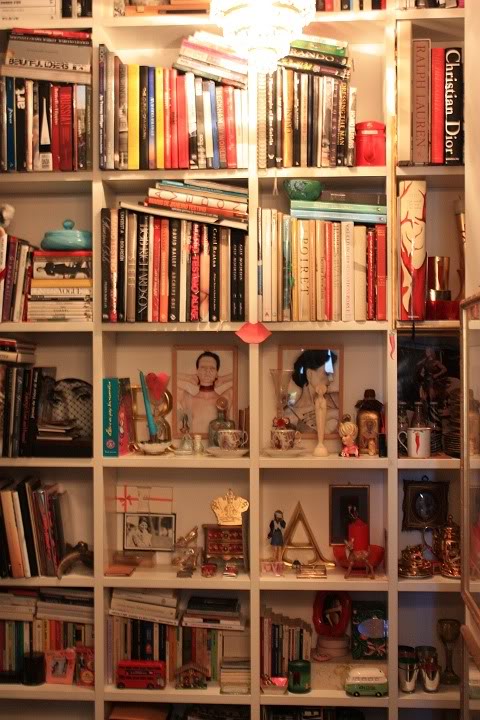
The height and width of the screenshot is (720, 480). What are the coordinates of `picture` in the screenshot? It's located at (210, 382), (312, 361), (158, 531), (67, 662), (350, 521), (422, 510).